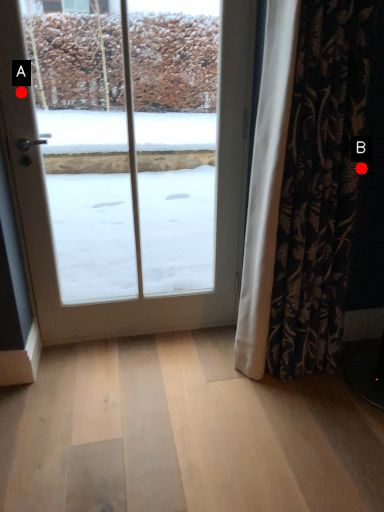
Question: Two points are circled on the image, labeled by A and B beside each circle. Which point is farther to the camera?

Choices:
 (A) A is further
 (B) B is further

Answer: (A)